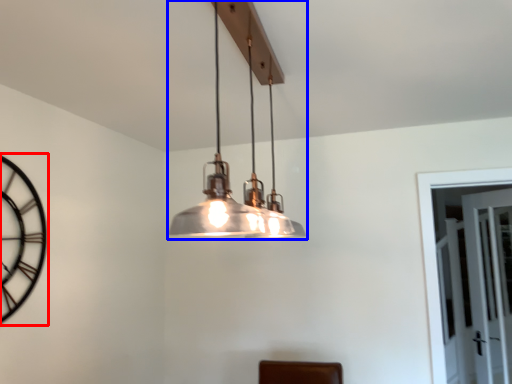
Question: Which object appears closest to the camera in this image, clock (highlighted by a red box) or lamp (highlighted by a blue box)?

Choices:
 (A) clock
 (B) lamp

Answer: (B)